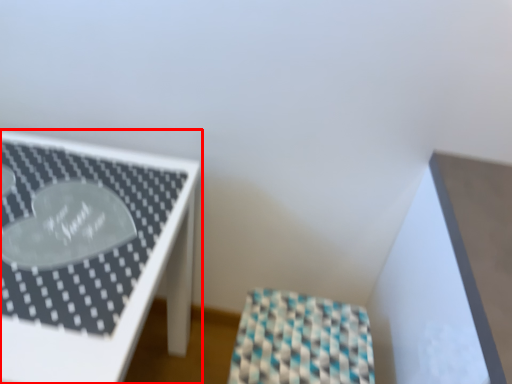
Question: In this image, where is furniture (annotated by the red box) located relative to furniture?

Choices:
 (A) right
 (B) left

Answer: (B)